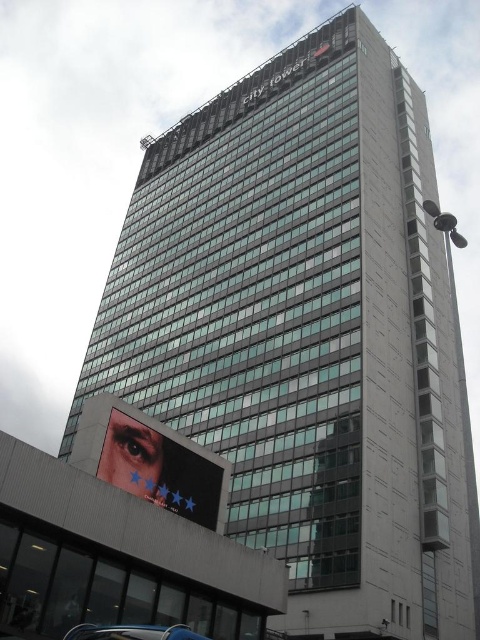
You are a photographer standing in front of the City Tower. You have two subjects in your viewfinder, the matte black eye at lower left and the metallic blue car at lower left. Which subject is wider?

The matte black eye at lower left is wider than the metallic blue car at lower left.

You are a delivery person standing at the entrance of the City Tower. You need to place a package on the ground between the matte black eye at lower left and the metallic blue car at lower left. Can you fit the package there if it requires a space of 8 meters?

The distance between the matte black eye at lower left and the metallic blue car at lower left is 8.46 meters, which is more than enough to accommodate the 8 meter requirement for placing the package.

You are a photographer standing at the base of the City Tower. You want to take a photo of the metallic blue car at lower left without the matte black eye at lower left blocking it. Is this possible?

The metallic blue car at lower left is behind the matte black eye at lower left, so it is already blocked by the eye. Therefore, you cannot take a photo of the metallic blue car at lower left without the matte black eye at lower left blocking it.